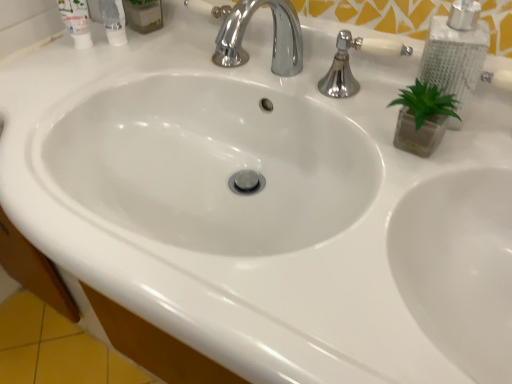
This screenshot has width=512, height=384. Identify the location of empty space that is in between polished chrome faucet at upper center and white plastic mouthwash at upper left, the second mouthwash positioned from the left. (232, 79).